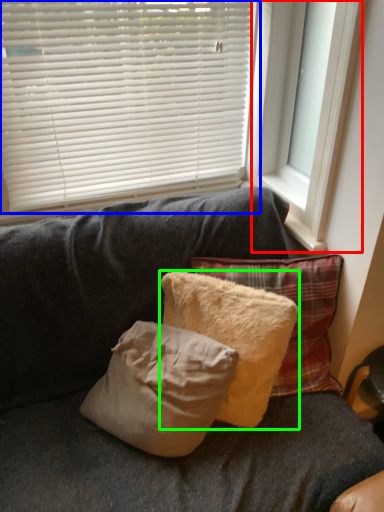
Question: Based on their relative distances, which object is nearer to window frame (highlighted by a red box)? Choose from window blind (highlighted by a blue box) and pillow (highlighted by a green box).

Choices:
 (A) window blind
 (B) pillow

Answer: (A)